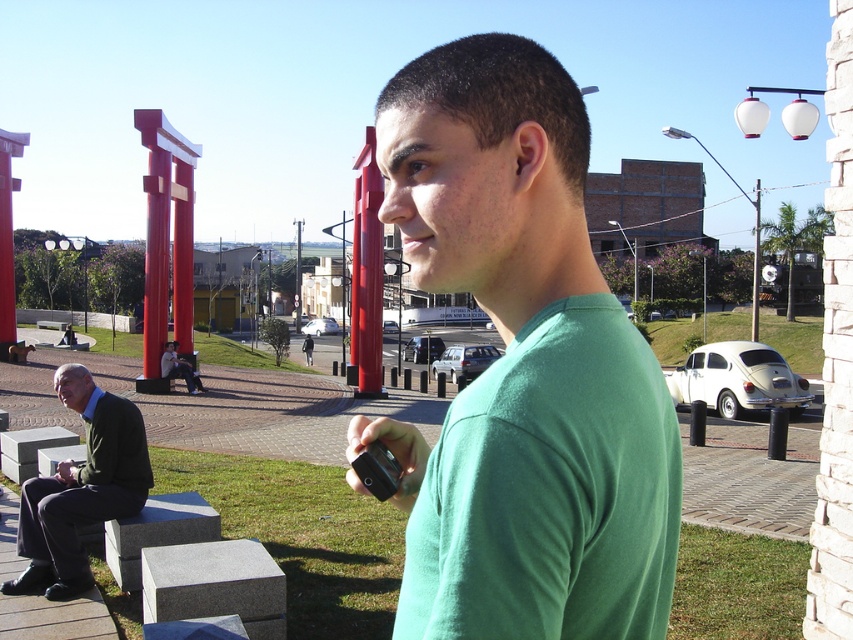
You are a photographer standing in the outdoor urban scene. You notice the dark green suit at lower left and the matte black phone at lower left. Which object is positioned lower in the image?

The dark green suit at lower left is located below the matte black phone at lower left, so it is positioned lower in the image.

You are standing at the center of the image and want to place a 100 feet long banner between the smooth glossy red torii gate at center and the black matte phone at center. Is this possible?

The smooth glossy red torii gate at center is 80.30 feet away from the black matte phone at center. Since the banner is 100 feet long, which is longer than the distance between them, it won